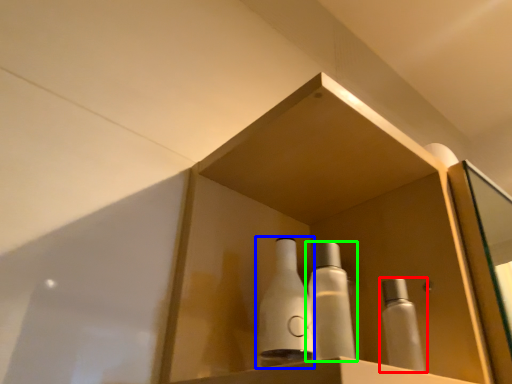
Question: Considering the real-world distances, which object is farthest from bottle (highlighted by a red box)? bottle (highlighted by a blue box) or bottle (highlighted by a green box)?

Choices:
 (A) bottle
 (B) bottle

Answer: (A)